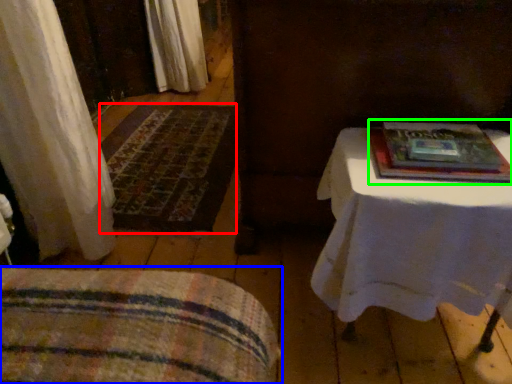
Question: Which object is the farthest from mat (highlighted by a red box)? Choose among these: furniture (highlighted by a blue box) or paperback book (highlighted by a green box).

Choices:
 (A) furniture
 (B) paperback book

Answer: (B)